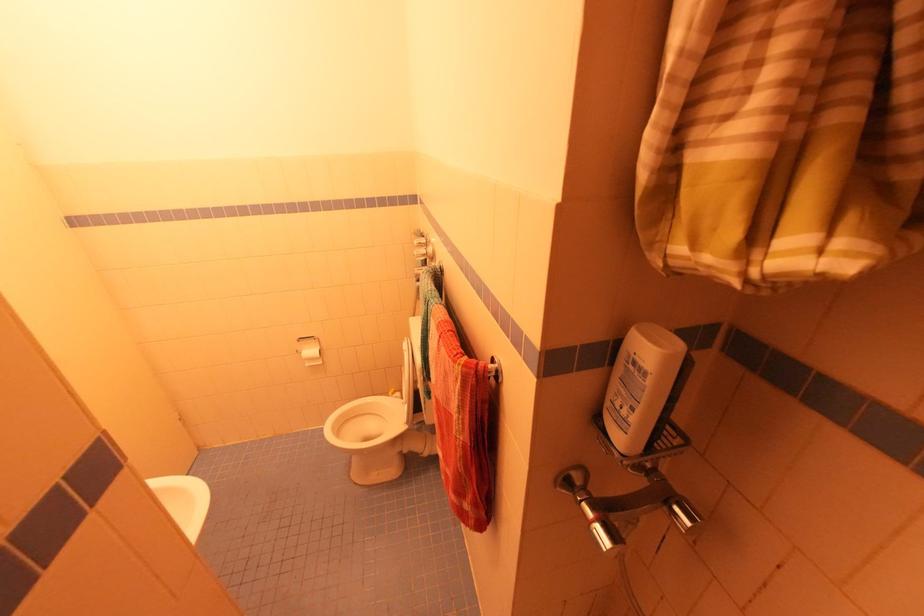
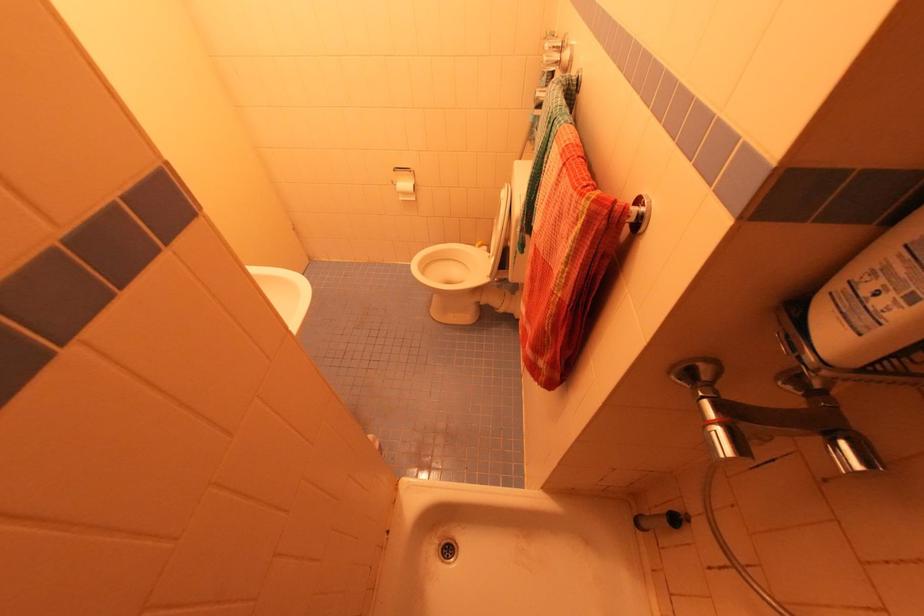
Find the pixel in the second image that matches point (441, 270) in the first image.

(577, 84)